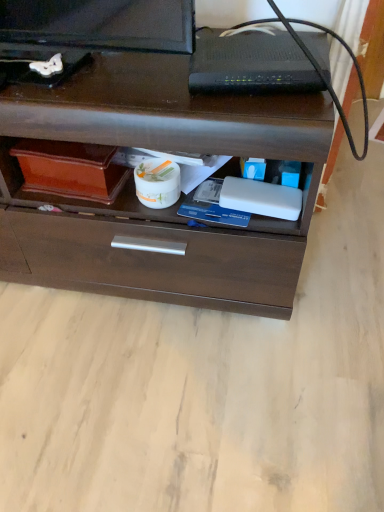
Find the location of a particular element. This screenshot has height=512, width=384. free space to the left of black plastic router at upper center is located at coordinates (137, 82).